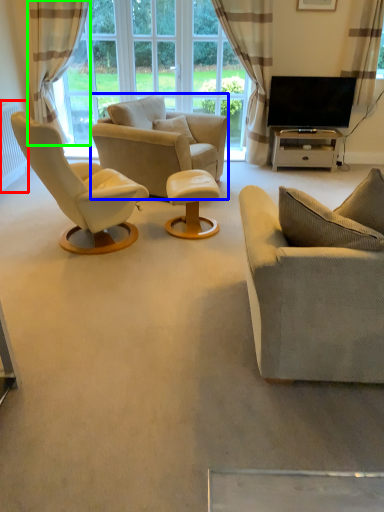
Question: Which object is the farthest from radiator (highlighted by a red box)? Choose among these: chair (highlighted by a blue box) or curtain (highlighted by a green box).

Choices:
 (A) chair
 (B) curtain

Answer: (A)